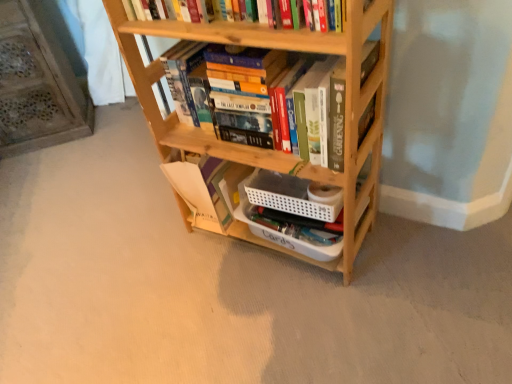
Question: Looking at their shapes, would you say wooden bookshelf at center is wider or thinner than wooden bookshelf at left?

Choices:
 (A) thin
 (B) wide

Answer: (A)

Question: Considering the positions of point (366, 127) and point (27, 72), is point (366, 127) closer or farther from the camera than point (27, 72)?

Choices:
 (A) closer
 (B) farther

Answer: (A)

Question: Considering the real-world distances, which object is closest to the wooden bookshelf at center?

Choices:
 (A) wooden bookshelf at left
 (B) natural wood bookcase at center

Answer: (B)

Question: Which is nearer to the wooden bookshelf at left?

Choices:
 (A) wooden bookshelf at center
 (B) natural wood bookcase at center

Answer: (B)